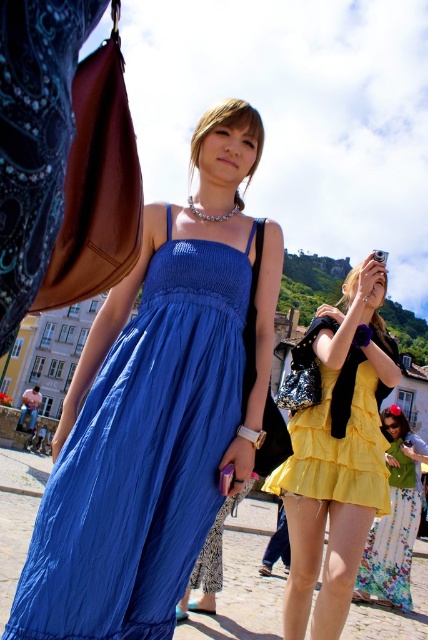
You are a photographer trying to capture the two women in the scene. The woman in the blue dress is standing at point (142, 456). Where should you position your camera to ensure both women are in frame?

Position the camera so that it captures the area around the point (142, 456) where the matte blue dress at center is located, ensuring the other woman is also within the frame.

You are a photographer trying to capture both the yellow satin dress at center and the yellow floral skirt at lower right in the same frame. Which one should you focus on first to ensure both are in focus?

The yellow satin dress at center is in front of the yellow floral skirt at lower right, so you should focus on the yellow satin dress at center first to ensure both are in focus.

You are a photographer trying to capture both the matte blue dress at center and the yellow floral skirt at lower right in the same frame. Based on their positions, which direction should you move your camera to include both subjects?

Since the matte blue dress at center is to the left of the yellow floral skirt at lower right, you should move your camera to the left to include both subjects in the frame.